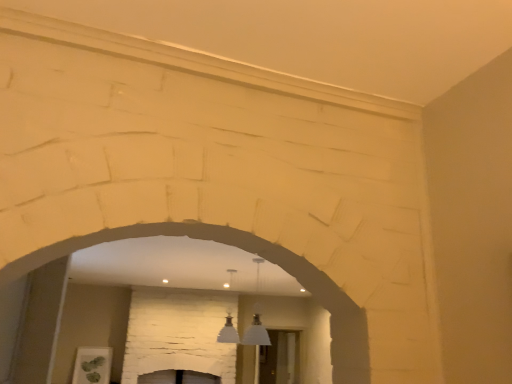
The width and height of the screenshot is (512, 384). What do you see at coordinates (256, 330) in the screenshot?
I see `white glass pendant light at center` at bounding box center [256, 330].

Measure the distance between white glass pendant light at center and camera.

white glass pendant light at center and camera are 3.81 meters apart.

Identify the location of white glass pendant light at center. This screenshot has width=512, height=384. (256, 330).

In order to face white glass pendant light at center, should I rotate leftwards or rightwards?

To align with it, rotate right about 0.313°.

Identify the location of white glass pendant light at center. (256, 330).